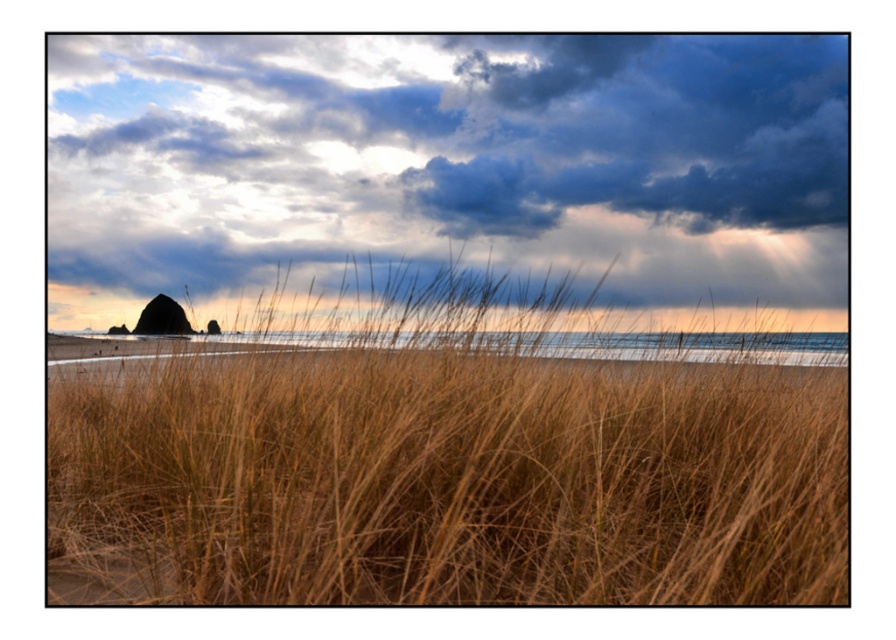
You are standing on the beach and want to take a photo of the brown dry grass at center and the dark blue textured cloud at upper center. Which object will appear larger in your photo?

The brown dry grass at center will appear larger in the photo because it is closer to the viewer than the dark blue textured cloud at upper center.

You are standing on the beach and see two points marked on the sand. The first point is at coordinate point(590, 376) and the second is at point(546, 208). Which point is closer to you?

Point(590, 376) is in front of point(546, 208), so it is closer to you.

In the scene shown: You are standing on the sandy beach in the midground of the coastal scene. You see a point marked at coordinates [444,451]. According to the scene description, where exactly is this point located?

The point at coordinates [444,451] is located on the brown dry grass at center.